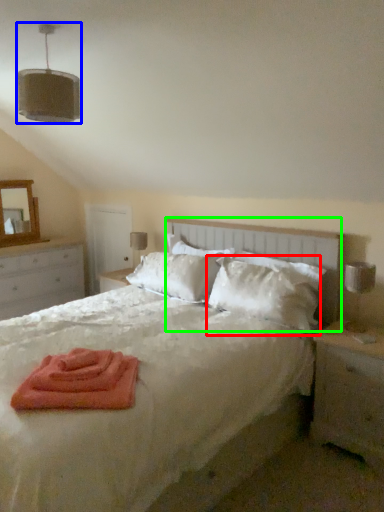
Question: Which object is positioned farthest from pillow (highlighted by a red box)? Select from light fixture (highlighted by a blue box) and headboard (highlighted by a green box).

Choices:
 (A) light fixture
 (B) headboard

Answer: (A)